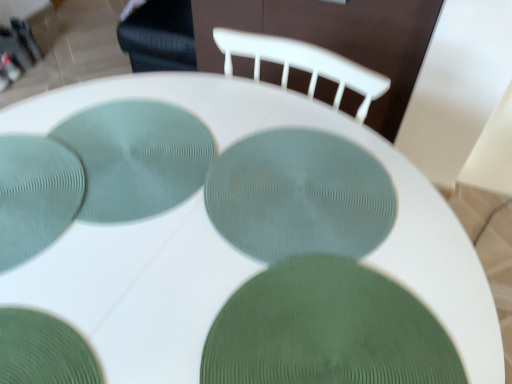
At what (x,y) coordinates should I click in order to perform the action: click on vacant space in between teal textured placemat at center, the third glass plate viewed from the left, and matte green plate at lower left, which is the first glass plate in left-to-right order. Please return your answer as a coordinate pair (x, y). Looking at the image, I should click on (84, 220).